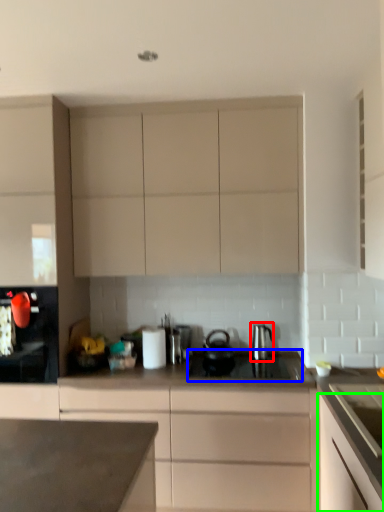
Question: Based on their relative distances, which object is farther from kitchen appliance (highlighted by a red box)? Choose from gas stove (highlighted by a blue box) and cabinetry (highlighted by a green box).

Choices:
 (A) gas stove
 (B) cabinetry

Answer: (B)